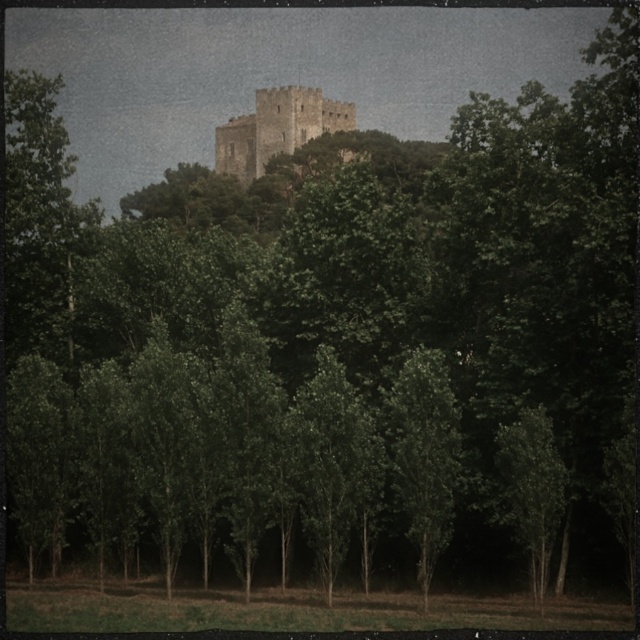
Does green leafy tree at lower right have a lesser width compared to light beige stone castle at center?

Yes.

Who is lower down, green leafy tree at lower right or light beige stone castle at center?

green leafy tree at lower right

Measure the distance between green leafy tree at lower right and camera.

green leafy tree at lower right and camera are 285.13 feet apart.

This screenshot has width=640, height=640. Find the location of `green leafy tree at lower right`. green leafy tree at lower right is located at coordinates (531, 490).